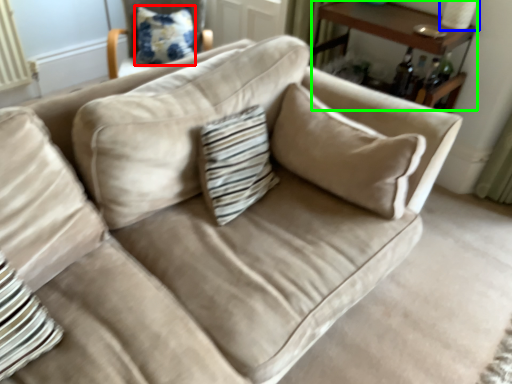
Question: Based on their relative distances, which object is nearer to pillow (highlighted by a red box)? Choose from table lamp (highlighted by a blue box) and table (highlighted by a green box).

Choices:
 (A) table lamp
 (B) table

Answer: (B)